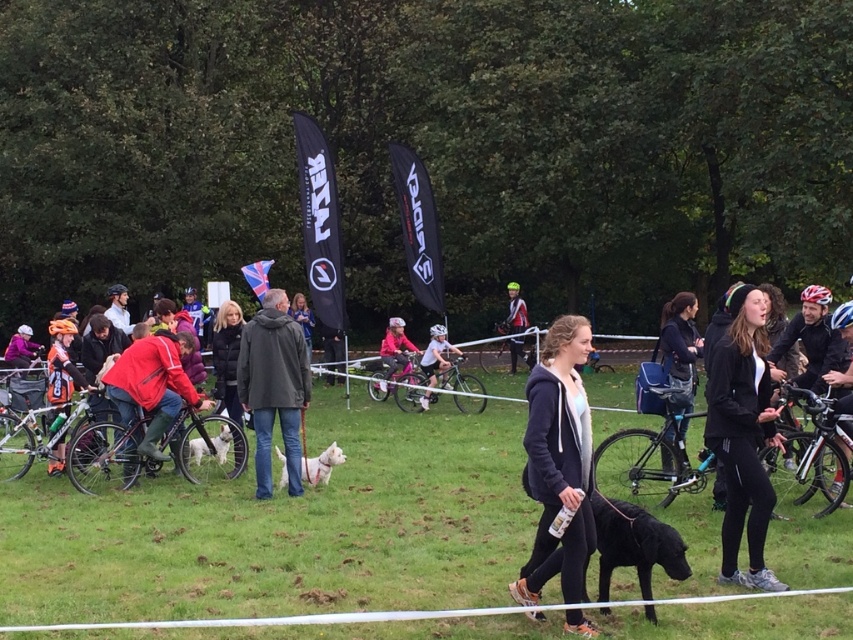
Is point (689, 301) closer to viewer compared to point (422, 362)?

Yes, it is.

Who is shorter, black leather jacket at center or white matte helmet at center?

Standing shorter between the two is black leather jacket at center.

The height and width of the screenshot is (640, 853). Identify the location of black leather jacket at center. [x=679, y=348].

Locate an element on the screen. black leather jacket at center is located at coordinates (679, 348).

Is point (743, 492) farther from camera compared to point (672, 310)?

No, (743, 492) is closer to viewer.

Which is behind, point (746, 416) or point (672, 412)?

Positioned behind is point (672, 412).

In order to click on black matte jacket at center in this screenshot , I will do (743, 435).

Can you confirm if dark green jacket at center is positioned above white matte helmet at center?

Correct, dark green jacket at center is located above white matte helmet at center.

The width and height of the screenshot is (853, 640). What do you see at coordinates (273, 387) in the screenshot?
I see `dark green jacket at center` at bounding box center [273, 387].

Between point (262, 484) and point (444, 369), which one is positioned in front?

Point (262, 484) is in front.

Identify the location of dark green jacket at center. (273, 387).